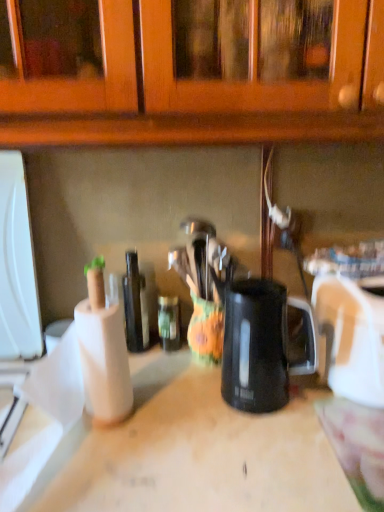
Question: From the image's perspective, does wooden at center appear lower than white plastic toaster at right?

Choices:
 (A) no
 (B) yes

Answer: (B)

Question: Is wooden at center at the right side of white plastic toaster at right?

Choices:
 (A) yes
 (B) no

Answer: (B)

Question: Is wooden at center surrounding white plastic toaster at right?

Choices:
 (A) no
 (B) yes

Answer: (A)

Question: Is wooden at center looking in the opposite direction of white plastic toaster at right?

Choices:
 (A) yes
 (B) no

Answer: (B)

Question: Can you confirm if wooden at center is shorter than white plastic toaster at right?

Choices:
 (A) yes
 (B) no

Answer: (B)

Question: Considering the relative positions of wooden at center and white plastic toaster at right in the image provided, is wooden at center to the left of white plastic toaster at right from the viewer's perspective?

Choices:
 (A) no
 (B) yes

Answer: (B)

Question: Is white plastic toaster at right bigger than black plastic mug at center?

Choices:
 (A) no
 (B) yes

Answer: (B)

Question: Is white plastic toaster at right with black plastic mug at center?

Choices:
 (A) no
 (B) yes

Answer: (A)

Question: From the image's perspective, is white plastic toaster at right above black plastic mug at center?

Choices:
 (A) yes
 (B) no

Answer: (A)

Question: Is white plastic toaster at right thinner than black plastic mug at center?

Choices:
 (A) no
 (B) yes

Answer: (A)

Question: Can you confirm if white plastic toaster at right is wider than black plastic mug at center?

Choices:
 (A) no
 (B) yes

Answer: (B)

Question: Is white plastic toaster at right oriented away from black plastic mug at center?

Choices:
 (A) yes
 (B) no

Answer: (B)

Question: Can you confirm if shiny dark glass bottle at center, positioned as the second bottle in right-to-left order, is thinner than white plastic toaster at right?

Choices:
 (A) no
 (B) yes

Answer: (B)